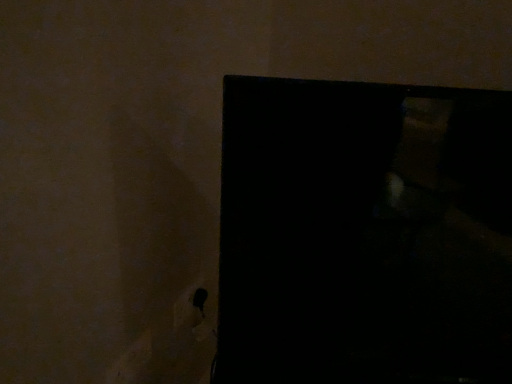
The image size is (512, 384). What do you see at coordinates (364, 234) in the screenshot?
I see `black glossy door at center` at bounding box center [364, 234].

I want to click on black glossy door at center, so click(x=364, y=234).

Find the location of a particular element. This screenshot has width=512, height=384. black glossy door at center is located at coordinates (364, 234).